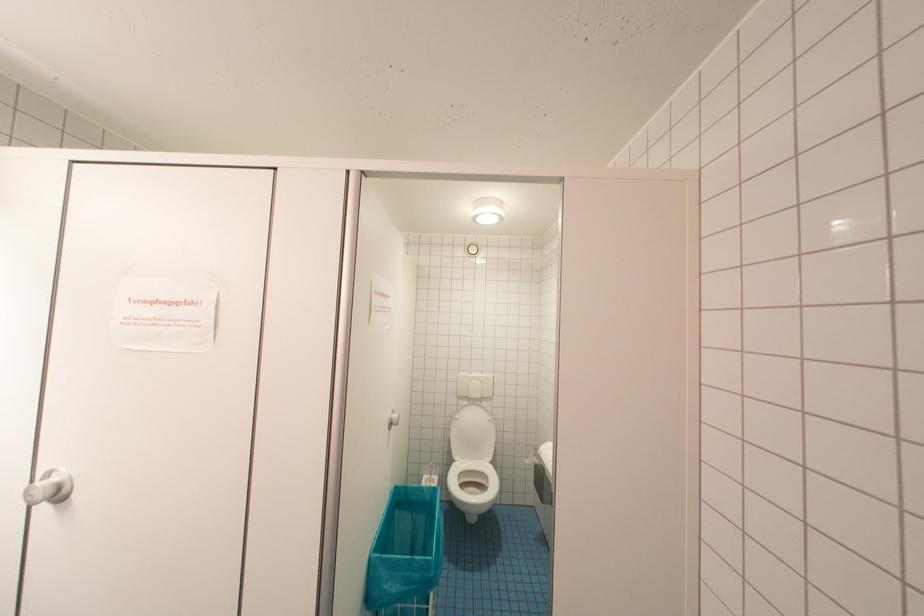
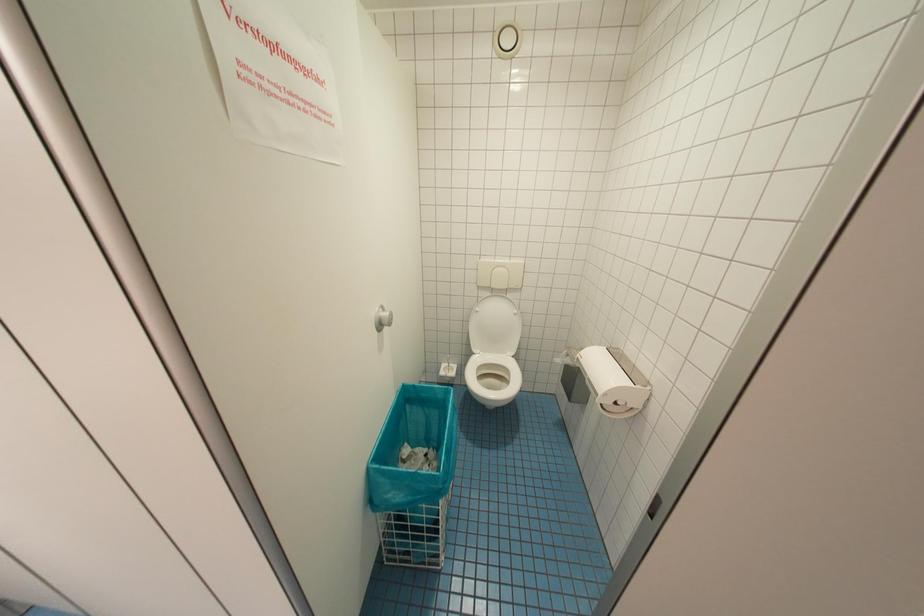
Question: How did the camera likely rotate?

Choices:
 (A) Left
 (B) Right
 (C) Up
 (D) Down

Answer: (D)